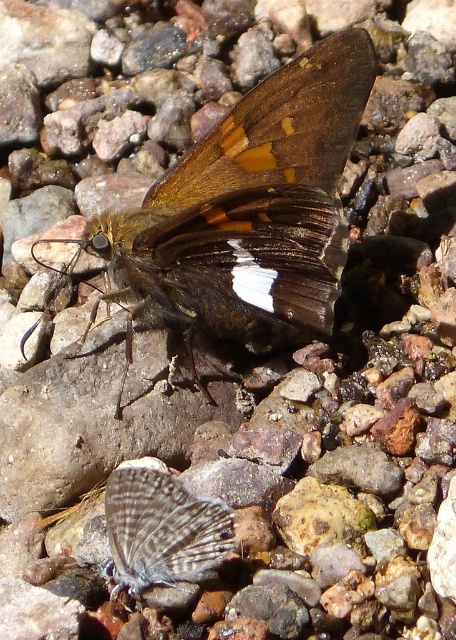
You are an entomologist observing two butterflies in a rocky area. You notice the brown matte wing at center and the speckled gray butterfly at center. Which of these two has a wider wing span?

The brown matte wing at center has a wider width than the speckled gray butterfly at center according to the description.